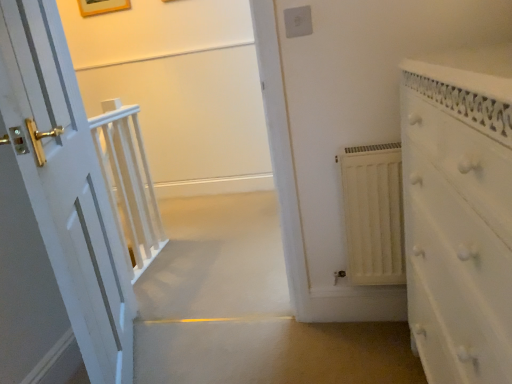
Question: Which is correct: white wooden balustrade at center is inside white plastic electric outlet at upper center, or outside of it?

Choices:
 (A) outside
 (B) inside

Answer: (A)

Question: Looking at their shapes, would you say white wooden balustrade at center is wider or thinner than white plastic electric outlet at upper center?

Choices:
 (A) thin
 (B) wide

Answer: (B)

Question: Estimate the real-world distances between objects in this image. Which object is farther from the white plastic electric outlet at upper center?

Choices:
 (A) white textured dresser at right
 (B) white wooden balustrade at center
 (C) wooden picture frame at upper center
 (D) white matte radiator at center right

Answer: (C)

Question: Considering the real-world distances, which object is farthest from the white matte radiator at center right?

Choices:
 (A) wooden picture frame at upper center
 (B) white textured dresser at right
 (C) white plastic electric outlet at upper center
 (D) white wooden balustrade at center

Answer: (A)